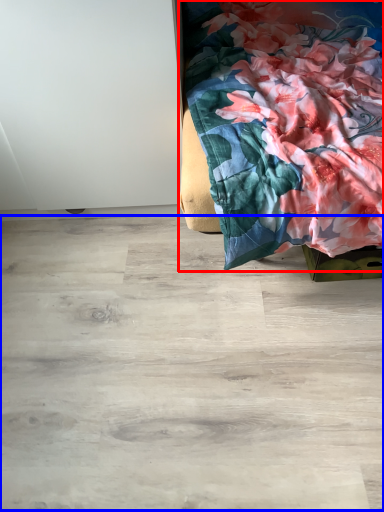
Question: Which object is closer to the camera taking this photo, furniture (highlighted by a red box) or plywood (highlighted by a blue box)?

Choices:
 (A) furniture
 (B) plywood

Answer: (A)